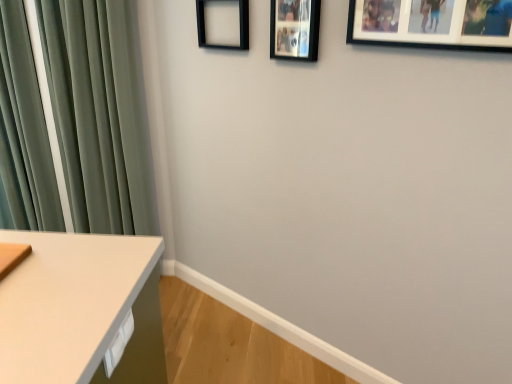
Image resolution: width=512 pixels, height=384 pixels. I want to click on black matte picture frame at upper right, which is the third picture frame from back to front, so click(432, 24).

What do you see at coordinates (239, 25) in the screenshot? This screenshot has height=384, width=512. I see `black matte picture frame at upper center, positioned as the 3th picture frame in front-to-back order` at bounding box center [239, 25].

Measure the distance between point (227, 44) and camera.

The depth of point (227, 44) is 1.80 meters.

Where is `green velvet curtain at left`? The height and width of the screenshot is (384, 512). green velvet curtain at left is located at coordinates click(100, 113).

What do you see at coordinates (294, 29) in the screenshot? The width and height of the screenshot is (512, 384). I see `black matte picture frame at upper center, acting as the 2th picture frame starting from the front` at bounding box center [294, 29].

Identify the location of white glossy drawer at lower left. pyautogui.click(x=118, y=344).

In the scene shown: Would you say green velvet curtain at left is a long distance from black matte picture frame at upper right, which is the third picture frame from back to front?

Yes, green velvet curtain at left and black matte picture frame at upper right, which is the third picture frame from back to front, are located far from each other.

Based on the photo, can you confirm if green velvet curtain at left is smaller than black matte picture frame at upper right, the 3th picture frame when ordered from left to right?

No.

From the image's perspective, is green velvet curtain at left positioned above or below black matte picture frame at upper right, the 3th picture frame when ordered from left to right?

green velvet curtain at left is situated lower than black matte picture frame at upper right, the 3th picture frame when ordered from left to right, in the image.

From the picture: Is green velvet curtain at left taller than black matte picture frame at upper right, the 3th picture frame when ordered from left to right?

Correct, green velvet curtain at left is much taller as black matte picture frame at upper right, the 3th picture frame when ordered from left to right.

Is black matte picture frame at upper center, marked as the second picture frame in a right-to-left arrangement, smaller than black matte picture frame at upper center, the 1th picture frame positioned from the back?

Yes, black matte picture frame at upper center, marked as the second picture frame in a right-to-left arrangement, is smaller than black matte picture frame at upper center, the 1th picture frame positioned from the back.

Does black matte picture frame at upper center, placed as the 2th picture frame when sorted from back to front, have a greater width compared to black matte picture frame at upper center, which is the 3th picture frame in right-to-left order?

No.

Looking at this image, between black matte picture frame at upper center, acting as the 2th picture frame starting from the front, and black matte picture frame at upper center, the 1th picture frame positioned from the back, which one is positioned in front?

Positioned in front is black matte picture frame at upper center, acting as the 2th picture frame starting from the front.

From a real-world perspective, relative to white glossy drawer at lower left, is green velvet curtain at left vertically above or below?

Clearly, from a real-world perspective, green velvet curtain at left is above white glossy drawer at lower left.

From the image's perspective, relative to white glossy drawer at lower left, is green velvet curtain at left above or below?

green velvet curtain at left is above white glossy drawer at lower left.

Based on their positions, is green velvet curtain at left located to the left or right of white glossy drawer at lower left?

In the image, green velvet curtain at left appears on the left side of white glossy drawer at lower left.

Does green velvet curtain at left come behind white glossy drawer at lower left?

Yes, green velvet curtain at left is further from the viewer.

Is black matte picture frame at upper right, the 1th picture frame in the front-to-back sequence, touching white glossy drawer at lower left?

black matte picture frame at upper right, the 1th picture frame in the front-to-back sequence, and white glossy drawer at lower left are not in contact.

From a real-world perspective, who is located higher, black matte picture frame at upper right, the 1th picture frame in the front-to-back sequence, or white glossy drawer at lower left?

From a 3D spatial view, black matte picture frame at upper right, the 1th picture frame in the front-to-back sequence, is above.

From the image's perspective, is black matte picture frame at upper right, which is the first picture frame from right to left, under white glossy drawer at lower left?

Actually, black matte picture frame at upper right, which is the first picture frame from right to left, appears above white glossy drawer at lower left in the image.

Considering the positions of objects black matte picture frame at upper right, the 3th picture frame when ordered from left to right, and white glossy drawer at lower left in the image provided, who is more to the right, black matte picture frame at upper right, the 3th picture frame when ordered from left to right, or white glossy drawer at lower left?

black matte picture frame at upper right, the 3th picture frame when ordered from left to right, is more to the right.

Does green velvet curtain at left come behind black matte picture frame at upper center, which is the second picture frame in left-to-right order?

Yes.

Is green velvet curtain at left situated inside black matte picture frame at upper center, acting as the 2th picture frame starting from the front, or outside?

green velvet curtain at left cannot be found inside black matte picture frame at upper center, acting as the 2th picture frame starting from the front.

Can you tell me how much green velvet curtain at left and black matte picture frame at upper center, marked as the second picture frame in a right-to-left arrangement, differ in facing direction?

The facing directions of green velvet curtain at left and black matte picture frame at upper center, marked as the second picture frame in a right-to-left arrangement, are 33.5 degrees apart.

From a real-world perspective, is green velvet curtain at left positioned above or below black matte picture frame at upper center, acting as the 2th picture frame starting from the front?

Clearly, from a real-world perspective, green velvet curtain at left is below black matte picture frame at upper center, acting as the 2th picture frame starting from the front.

Does point (204, 22) lie in front of point (37, 136)?

Yes, point (204, 22) is in front of point (37, 136).

Is black matte picture frame at upper center, which is the 3th picture frame in right-to-left order, positioned behind green velvet curtain at left?

That is False.

Is black matte picture frame at upper center, positioned as the 3th picture frame in front-to-back order, not inside green velvet curtain at left?

Yes, black matte picture frame at upper center, positioned as the 3th picture frame in front-to-back order, is located beyond the bounds of green velvet curtain at left.

Relative to black matte picture frame at upper center, which is the 3th picture frame in right-to-left order, is black matte picture frame at upper right, which is the first picture frame from right to left, in front or behind?

Clearly, black matte picture frame at upper right, which is the first picture frame from right to left, is in front of black matte picture frame at upper center, which is the 3th picture frame in right-to-left order.

Does black matte picture frame at upper right, the 3th picture frame when ordered from left to right, turn towards black matte picture frame at upper center, positioned as the 3th picture frame in front-to-back order?

No, black matte picture frame at upper right, the 3th picture frame when ordered from left to right, is not facing towards black matte picture frame at upper center, positioned as the 3th picture frame in front-to-back order.

Is black matte picture frame at upper right, the 1th picture frame in the front-to-back sequence, thinner than black matte picture frame at upper center, which appears as the first picture frame when viewed from the left?

No, black matte picture frame at upper right, the 1th picture frame in the front-to-back sequence, is not thinner than black matte picture frame at upper center, which appears as the first picture frame when viewed from the left.

Would you say black matte picture frame at upper center, positioned as the 3th picture frame in front-to-back order, is part of black matte picture frame at upper right, the 3th picture frame when ordered from left to right,'s contents?

No, black matte picture frame at upper center, positioned as the 3th picture frame in front-to-back order, is not surrounded by black matte picture frame at upper right, the 3th picture frame when ordered from left to right.

Identify the location of curtain directly beneath the black matte picture frame at upper right, the 1th picture frame in the front-to-back sequence (from a real-world perspective). (100, 113).

Find the location of a particular element. This screenshot has height=384, width=512. the 1st picture frame in front of the black matte picture frame at upper center, which appears as the first picture frame when viewed from the left, counting from the anchor's position is located at coordinates (294, 29).

Looking at the image, which one is located closer to black matte picture frame at upper right, the 1th picture frame in the front-to-back sequence, black matte picture frame at upper center, placed as the 2th picture frame when sorted from back to front, or green velvet curtain at left?

black matte picture frame at upper center, placed as the 2th picture frame when sorted from back to front, lies closer to black matte picture frame at upper right, the 1th picture frame in the front-to-back sequence, than the other object.

Considering their positions, is black matte picture frame at upper center, which is the 3th picture frame in right-to-left order, positioned further to black matte picture frame at upper center, acting as the 2th picture frame starting from the front, than black matte picture frame at upper right, which is the first picture frame from right to left?

black matte picture frame at upper right, which is the first picture frame from right to left.

Looking at the image, which one is located further to white glossy drawer at lower left, black matte picture frame at upper center, which is the second picture frame in left-to-right order, or green velvet curtain at left?

green velvet curtain at left.

Looking at the image, which one is located closer to black matte picture frame at upper right, which is the third picture frame from back to front, black matte picture frame at upper center, placed as the 2th picture frame when sorted from back to front, or black matte picture frame at upper center, which appears as the first picture frame when viewed from the left?

black matte picture frame at upper center, placed as the 2th picture frame when sorted from back to front.

When comparing their distances from green velvet curtain at left, does black matte picture frame at upper right, the 3th picture frame when ordered from left to right, or black matte picture frame at upper center, which is the second picture frame in left-to-right order, seem closer?

The object closer to green velvet curtain at left is black matte picture frame at upper center, which is the second picture frame in left-to-right order.

From the image, which object appears to be farther from black matte picture frame at upper right, the 3th picture frame when ordered from left to right, green velvet curtain at left or white glossy drawer at lower left?

Among the two, green velvet curtain at left is located further to black matte picture frame at upper right, the 3th picture frame when ordered from left to right.

Based on their spatial positions, is black matte picture frame at upper right, which is the first picture frame from right to left, or green velvet curtain at left closer to black matte picture frame at upper center, which is the 3th picture frame in right-to-left order?

Among the two, black matte picture frame at upper right, which is the first picture frame from right to left, is located nearer to black matte picture frame at upper center, which is the 3th picture frame in right-to-left order.

When comparing their distances from green velvet curtain at left, does black matte picture frame at upper right, which is the first picture frame from right to left, or black matte picture frame at upper center, which appears as the first picture frame when viewed from the left, seem further?

The object further to green velvet curtain at left is black matte picture frame at upper right, which is the first picture frame from right to left.

Locate an element on the screen. The height and width of the screenshot is (384, 512). picture frame between black matte picture frame at upper center, which is the second picture frame in left-to-right order, and white glossy drawer at lower left vertically is located at coordinates (432, 24).

Locate an element on the screen. drawer between green velvet curtain at left and black matte picture frame at upper right, which is the third picture frame from back to front, from left to right is located at coordinates (118, 344).

Find the location of a particular element. The width and height of the screenshot is (512, 384). drawer situated between green velvet curtain at left and black matte picture frame at upper center, which is the second picture frame in left-to-right order, from left to right is located at coordinates (118, 344).

At what (x,y) coordinates should I click in order to perform the action: click on picture frame between green velvet curtain at left and black matte picture frame at upper center, marked as the second picture frame in a right-to-left arrangement. Please return your answer as a coordinate pair (x, y). This screenshot has height=384, width=512. Looking at the image, I should click on (239, 25).